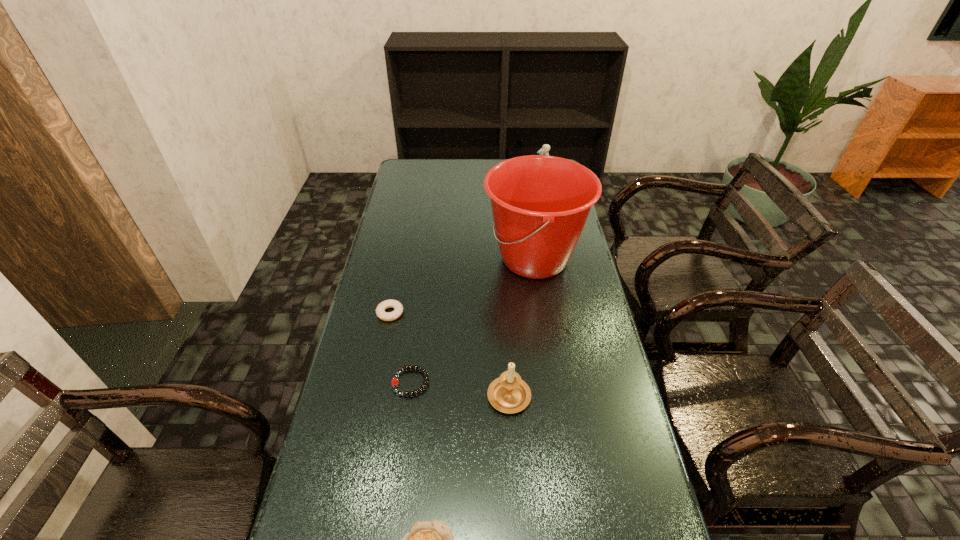
You are a GUI agent. You are given a task and a screenshot of the screen. Output one action in this format:
    pyautogui.click(x=<x>, y=<y>)
    Task: Click on the doughnut that is at the left edge
    This screenshot has width=960, height=540.
    Given the screenshot: What is the action you would take?
    pyautogui.click(x=398, y=308)

Find the location of a particular element. The image size is (960, 540). bracelet at the left edge is located at coordinates (395, 381).

Locate an element on the screen. The width and height of the screenshot is (960, 540). bucket positioned at the right edge is located at coordinates (540, 204).

Image resolution: width=960 pixels, height=540 pixels. In order to click on figurine positioned at the right edge in this screenshot , I will do `click(544, 150)`.

What are the coordinates of `object that is at the far right corner` in the screenshot? It's located at (544, 150).

Image resolution: width=960 pixels, height=540 pixels. In the image, there is a desktop. What are the coordinates of `free space at the far edge` in the screenshot? It's located at (463, 174).

Where is `free space at the left edge`? This screenshot has width=960, height=540. free space at the left edge is located at coordinates (409, 252).

Identify the location of vacant space at the right edge of the desktop. Image resolution: width=960 pixels, height=540 pixels. click(x=573, y=255).

You are a GUI agent. You are given a task and a screenshot of the screen. Output one action in this format:
    pyautogui.click(x=<x>, y=<y>)
    Task: Click on the blank region between the fourth shortest object and the bracelet
    Image resolution: width=960 pixels, height=540 pixels.
    Given the screenshot: What is the action you would take?
    pyautogui.click(x=460, y=388)

Identify the location of vacant space that is in between the bracelet and the third farthest object. The image size is (960, 540). (400, 348).